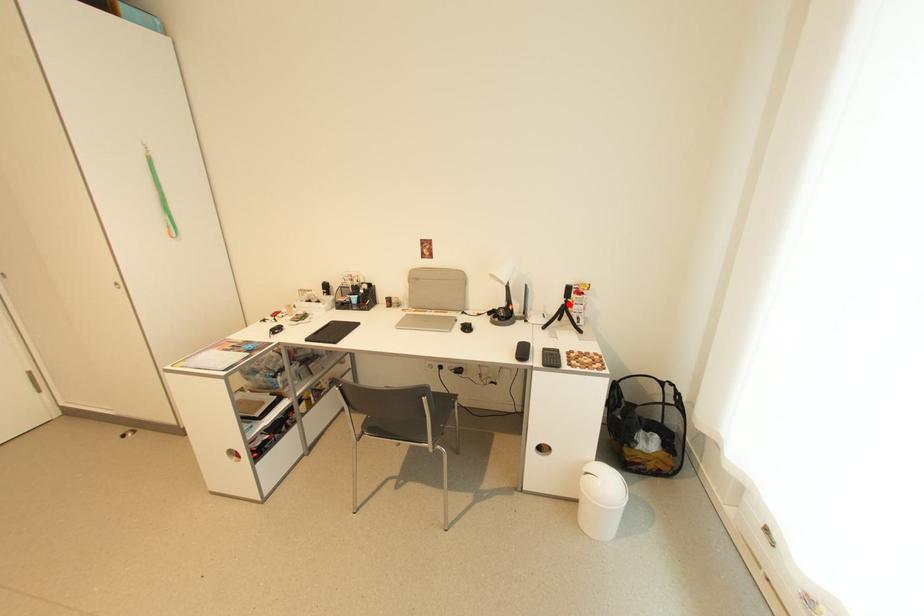
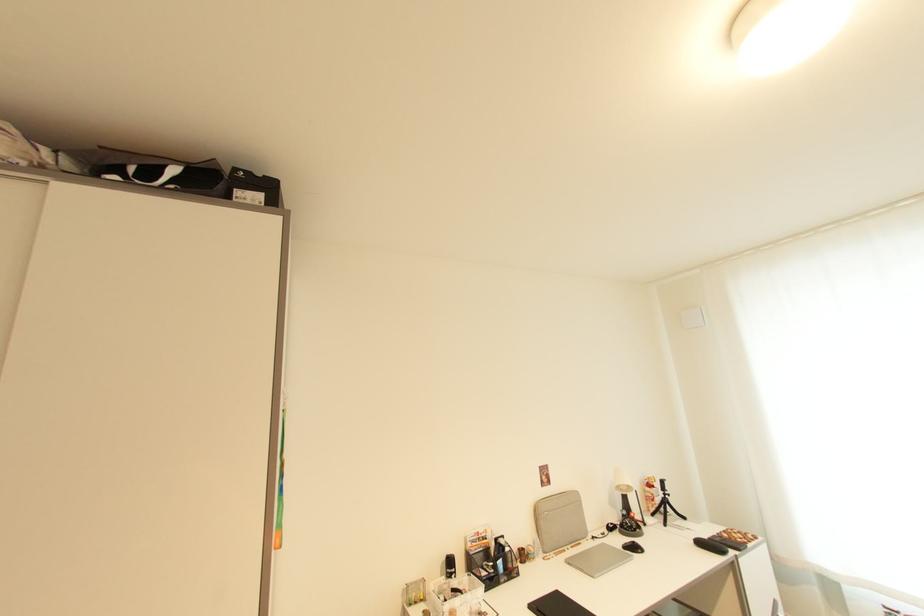
Locate, in the second image, the point that corresponds to the highlighted location in the first image.

(669, 498)